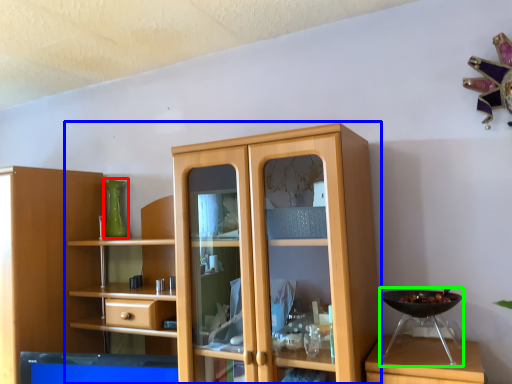
Question: Based on their relative distances, which object is nearer to glass vase (highlighted by a red box)? Choose from cupboard (highlighted by a blue box) and appliance (highlighted by a green box).

Choices:
 (A) cupboard
 (B) appliance

Answer: (A)